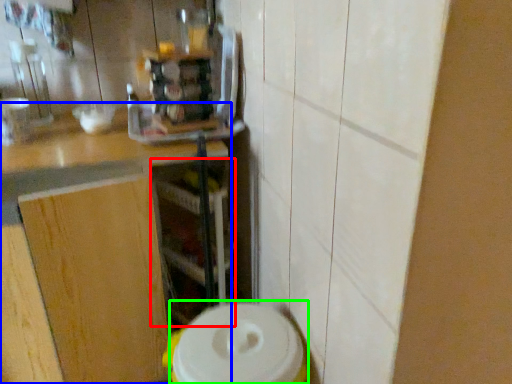
Question: Considering the real-world distances, which object is closest to shelf (highlighted by a red box)? countertop (highlighted by a blue box) or appliance (highlighted by a green box).

Choices:
 (A) countertop
 (B) appliance

Answer: (A)